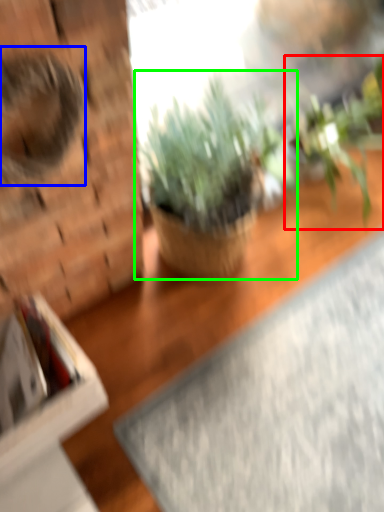
Question: Considering the real-world distances, which object is closest to houseplant (highlighted by a red box)? animal (highlighted by a blue box) or houseplant (highlighted by a green box).

Choices:
 (A) animal
 (B) houseplant

Answer: (B)